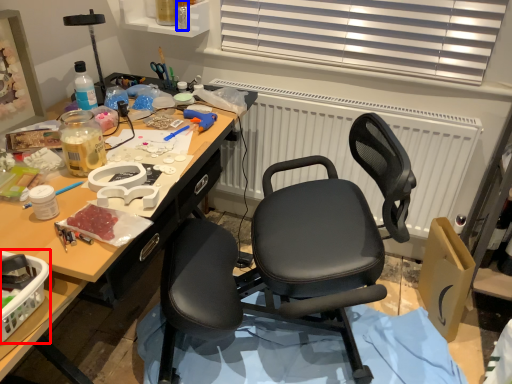
Question: Which object appears closest to the camera in this image, box (highlighted by a red box) or bottle (highlighted by a blue box)?

Choices:
 (A) box
 (B) bottle

Answer: (A)